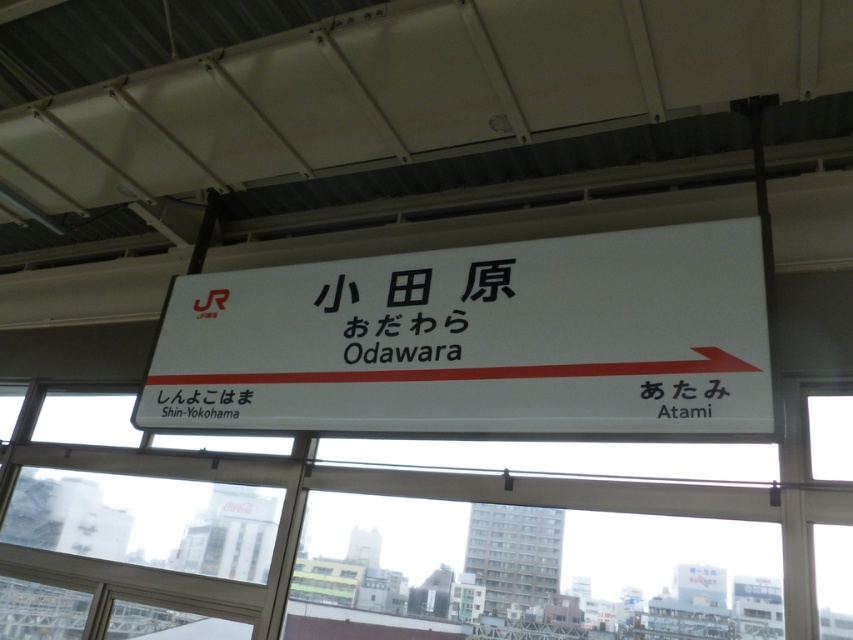
Measure the distance between point [503,298] and camera.

They are 8.30 feet apart.

You are a GUI agent. You are given a task and a screenshot of the screen. Output one action in this format:
    pyautogui.click(x=<x>, y=<y>)
    Task: Click on the white plastic sign at center
    The image size is (853, 640).
    Given the screenshot: What is the action you would take?
    pyautogui.click(x=477, y=340)